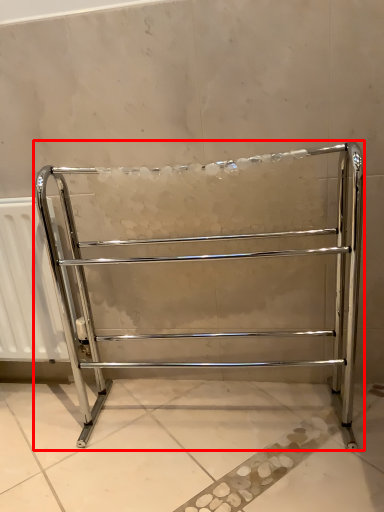
Question: From the image's perspective, where is furniture (annotated by the red box) located in relation to radiator in the image?

Choices:
 (A) below
 (B) above

Answer: (B)